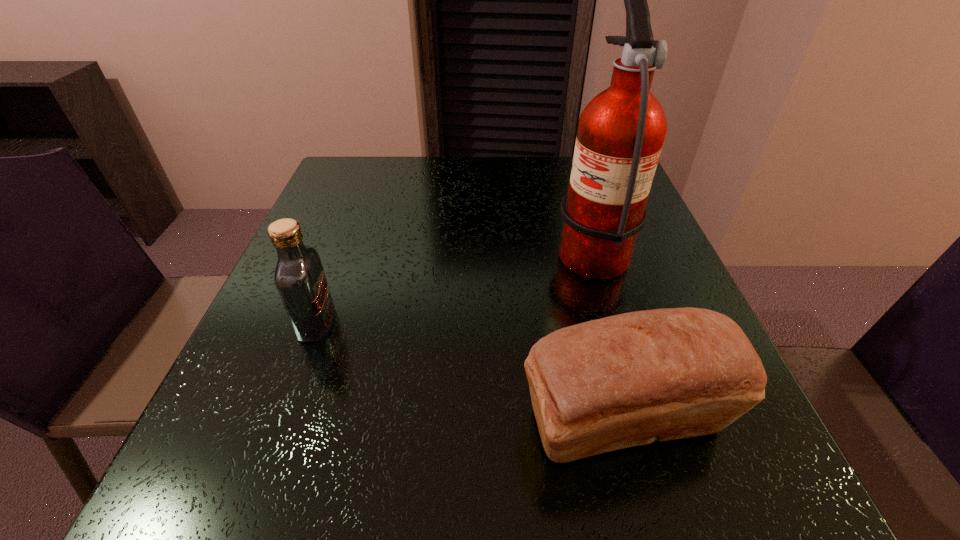
In the image, there is a desktop. What are the coordinates of `free space at the near left corner` in the screenshot? It's located at (227, 459).

Image resolution: width=960 pixels, height=540 pixels. Identify the location of vacant area that lies between the vodka and the tallest object. (454, 285).

Locate an element on the screen. The height and width of the screenshot is (540, 960). free spot between the second nearest object and the tallest object is located at coordinates (454, 285).

Image resolution: width=960 pixels, height=540 pixels. What are the coordinates of `free space between the tallest object and the second nearest object` in the screenshot? It's located at (454, 285).

This screenshot has height=540, width=960. I want to click on vacant region between the farthest object and the vodka, so click(x=454, y=285).

Find the location of `vacant space in between the fire extinguisher and the second farthest object`. vacant space in between the fire extinguisher and the second farthest object is located at coordinates (454, 285).

Locate an element on the screen. vacant space that's between the second nearest object and the nearest object is located at coordinates (470, 372).

Find the location of a particular element. Image resolution: width=960 pixels, height=540 pixels. free spot between the vodka and the tallest object is located at coordinates (454, 285).

The height and width of the screenshot is (540, 960). Identify the location of object identified as the second closest to the tallest object. (299, 276).

Locate an element on the screen. The width and height of the screenshot is (960, 540). object that ranks as the closest to the nearest object is located at coordinates (621, 131).